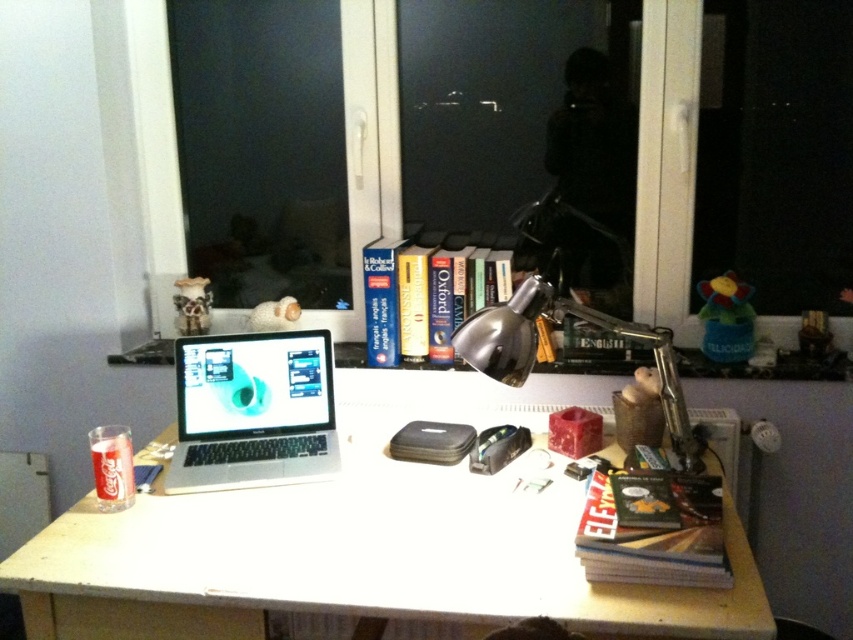
Question: Which point is farther to the camera?

Choices:
 (A) sleek silver laptop at center
 (B) white matte table at center
 (C) hardcover book at center

Answer: (C)

Question: Which point is closer to the camera?

Choices:
 (A) (404, 576)
 (B) (314, 339)
 (C) (415, 300)
 (D) (686, 212)

Answer: (A)

Question: Among these points, which one is nearest to the camera?

Choices:
 (A) pyautogui.click(x=50, y=531)
 (B) pyautogui.click(x=651, y=173)
 (C) pyautogui.click(x=643, y=484)

Answer: (C)

Question: Can you confirm if white matte table at center is thinner than hardcover book at center?

Choices:
 (A) no
 (B) yes

Answer: (A)

Question: Is white matte table at center above sleek silver laptop at center?

Choices:
 (A) yes
 (B) no

Answer: (B)

Question: Where is hardcover book at lower right located in relation to hardcover book at center in the image?

Choices:
 (A) above
 (B) below

Answer: (B)